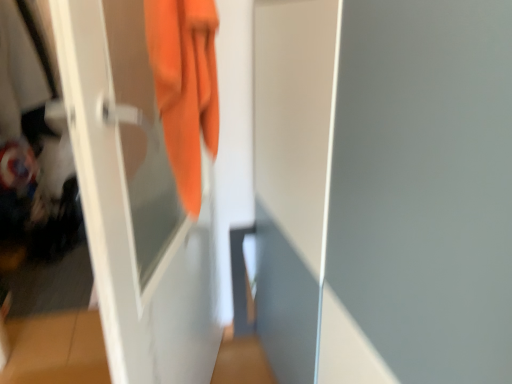
Question: Is the depth of white glossy screen door at center, which is counted as the first screen door, starting from the right, less than that of orange fabric towel at upper left?

Choices:
 (A) yes
 (B) no

Answer: (A)

Question: Does white glossy screen door at center, which is counted as the first screen door, starting from the right, touch orange fabric towel at upper left?

Choices:
 (A) no
 (B) yes

Answer: (A)

Question: Is white glossy screen door at center, the second screen door in the left-to-right sequence, not near orange fabric towel at upper left?

Choices:
 (A) yes
 (B) no

Answer: (B)

Question: Is white glossy screen door at center, which is counted as the first screen door, starting from the right, at the right side of orange fabric towel at upper left?

Choices:
 (A) yes
 (B) no

Answer: (A)

Question: Does white glossy screen door at center, which is counted as the first screen door, starting from the right, have a lesser width compared to orange fabric towel at upper left?

Choices:
 (A) no
 (B) yes

Answer: (A)

Question: Is white glossy screen door at center, the second screen door in the left-to-right sequence, looking in the opposite direction of orange fabric towel at upper left?

Choices:
 (A) yes
 (B) no

Answer: (B)

Question: Considering the relative positions of white glossy screen door at center, which is counted as the first screen door, starting from the right, and white glossy screen door at left, which ranks as the second screen door in right-to-left order, in the image provided, is white glossy screen door at center, which is counted as the first screen door, starting from the right, to the right of white glossy screen door at left, which ranks as the second screen door in right-to-left order, from the viewer's perspective?

Choices:
 (A) no
 (B) yes

Answer: (B)

Question: Is white glossy screen door at center, which is counted as the first screen door, starting from the right, directly adjacent to white glossy screen door at left, which is counted as the 1th screen door, starting from the left?

Choices:
 (A) no
 (B) yes

Answer: (A)

Question: Does white glossy screen door at center, which is counted as the first screen door, starting from the right, contain white glossy screen door at left, which ranks as the second screen door in right-to-left order?

Choices:
 (A) yes
 (B) no

Answer: (B)

Question: Does white glossy screen door at center, which is counted as the first screen door, starting from the right, have a greater width compared to white glossy screen door at left, which is counted as the 1th screen door, starting from the left?

Choices:
 (A) yes
 (B) no

Answer: (A)

Question: Considering the relative sizes of white glossy screen door at center, the second screen door in the left-to-right sequence, and white glossy screen door at left, which is counted as the 1th screen door, starting from the left, in the image provided, is white glossy screen door at center, the second screen door in the left-to-right sequence, shorter than white glossy screen door at left, which is counted as the 1th screen door, starting from the left,?

Choices:
 (A) no
 (B) yes

Answer: (A)

Question: From a real-world perspective, is white glossy screen door at center, the second screen door in the left-to-right sequence, under white glossy screen door at left, which is counted as the 1th screen door, starting from the left?

Choices:
 (A) no
 (B) yes

Answer: (B)

Question: From a real-world perspective, is orange fabric towel at upper left below white glossy screen door at center, which is counted as the first screen door, starting from the right?

Choices:
 (A) no
 (B) yes

Answer: (A)